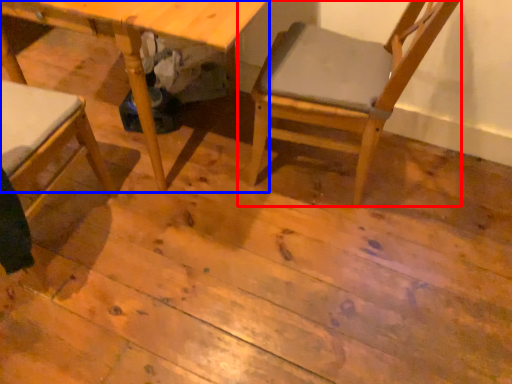
Question: Which point is further to the camera, chair (highlighted by a red box) or table (highlighted by a blue box)?

Choices:
 (A) chair
 (B) table

Answer: (B)